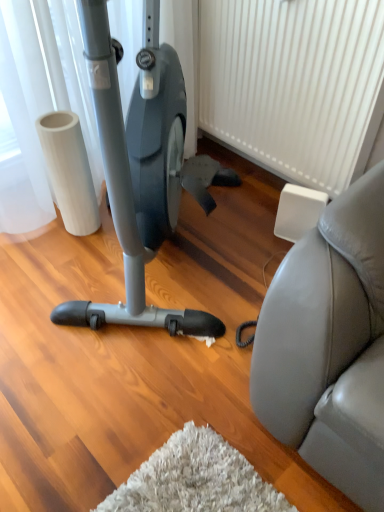
Question: In terms of width, does matte black stationary bicycle at center look wider or thinner when compared to white textured radiator at center?

Choices:
 (A) wide
 (B) thin

Answer: (A)

Question: Is matte black stationary bicycle at center taller or shorter than white textured radiator at center?

Choices:
 (A) short
 (B) tall

Answer: (B)

Question: Is matte black stationary bicycle at center situated inside white textured radiator at center or outside?

Choices:
 (A) inside
 (B) outside

Answer: (B)

Question: Is white textured radiator at center wider or thinner than matte black stationary bicycle at center?

Choices:
 (A) wide
 (B) thin

Answer: (B)

Question: In the image, is white textured radiator at center positioned in front of or behind matte black stationary bicycle at center?

Choices:
 (A) behind
 (B) front

Answer: (A)

Question: Is white textured radiator at center taller or shorter than matte black stationary bicycle at center?

Choices:
 (A) tall
 (B) short

Answer: (B)

Question: In terms of size, does white textured radiator at center appear bigger or smaller than matte black stationary bicycle at center?

Choices:
 (A) small
 (B) big

Answer: (A)